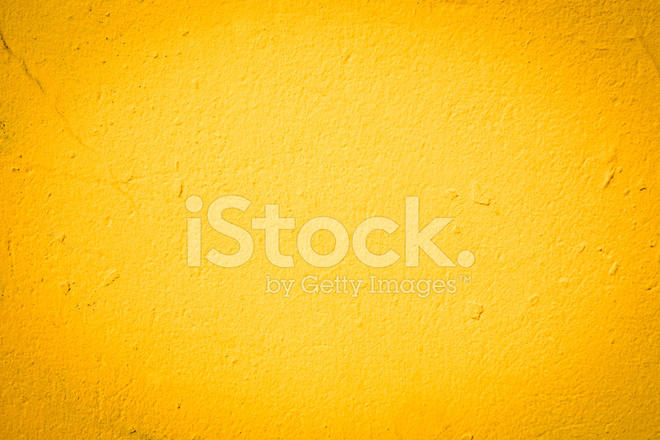
This screenshot has width=660, height=440. I want to click on orange wall, so click(341, 144).